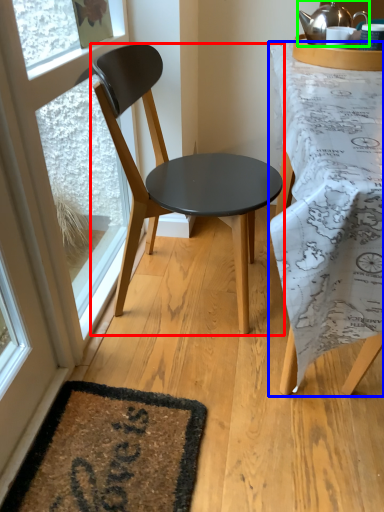
Question: Considering the real-world distances, which object is closest to chair (highlighted by a red box)? desk (highlighted by a blue box) or kettle (highlighted by a green box).

Choices:
 (A) desk
 (B) kettle

Answer: (A)